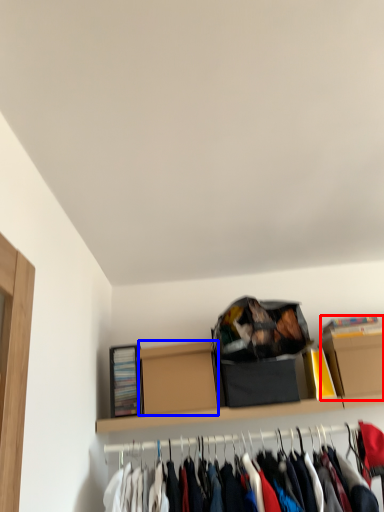
Question: Which object appears closest to the camera in this image, cardboard box (highlighted by a red box) or cardboard box (highlighted by a blue box)?

Choices:
 (A) cardboard box
 (B) cardboard box

Answer: (B)